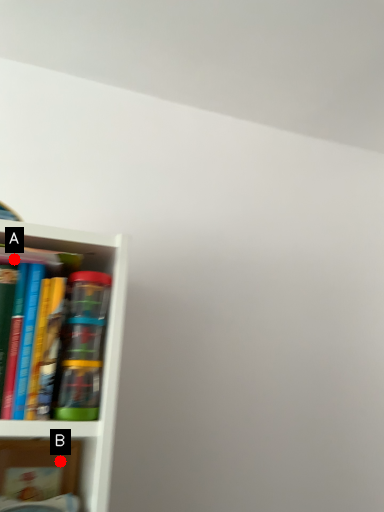
Question: Two points are circled on the image, labeled by A and B beside each circle. Which point is closer to the camera?

Choices:
 (A) A is closer
 (B) B is closer

Answer: (A)